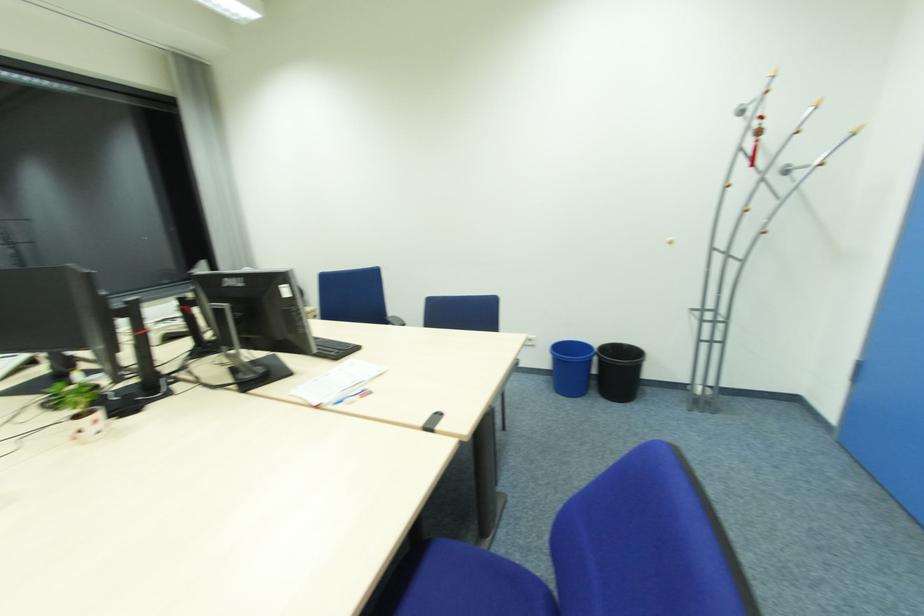
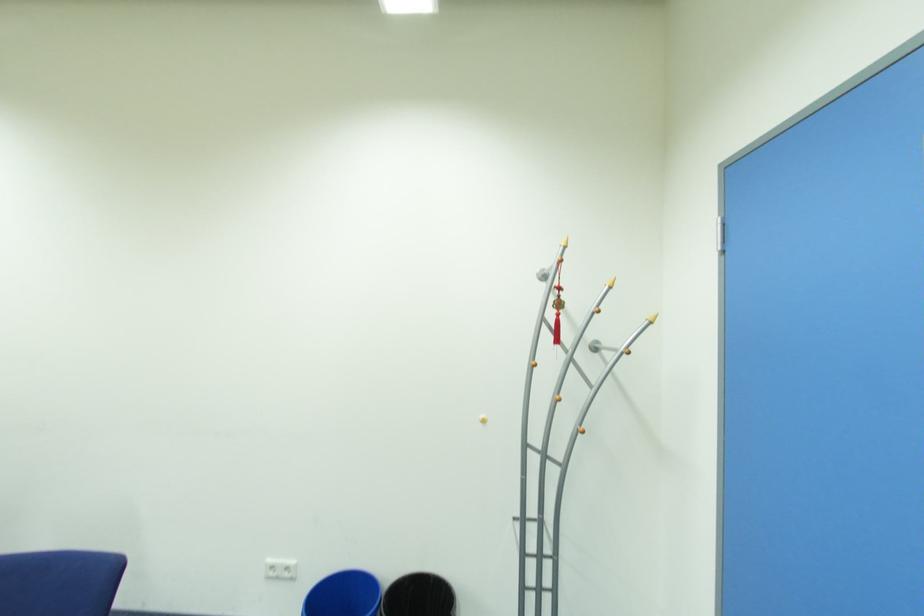
In a continuous first-person perspective shot, in which direction is the camera moving?

The cameraman moved toward right, forward.